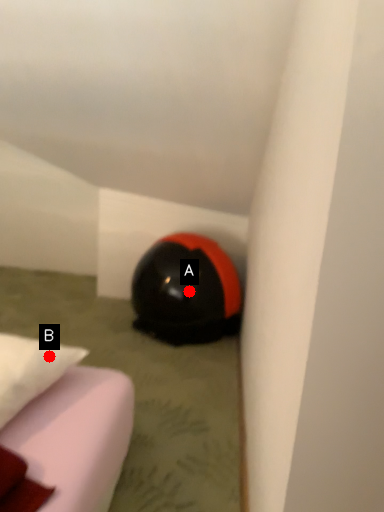
Question: Two points are circled on the image, labeled by A and B beside each circle. Among these points, which one is nearest to the camera?

Choices:
 (A) A is closer
 (B) B is closer

Answer: (B)